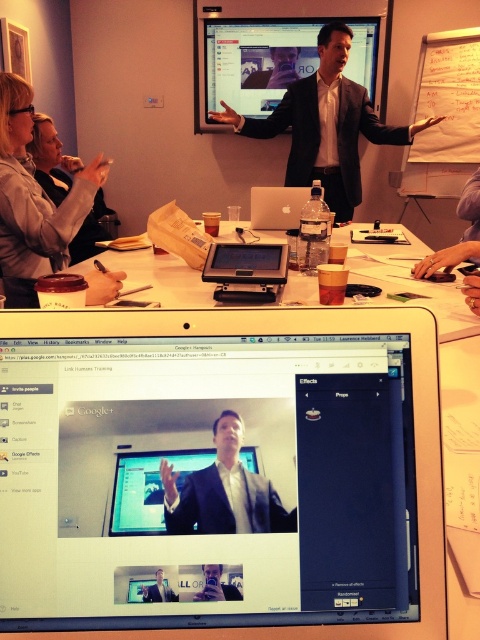
Is matte black monitor at center wider than matte black suit at upper center?

Incorrect, matte black monitor at center's width does not surpass matte black suit at upper center's.

Is point (131, 497) farther from camera compared to point (265, 83)?

No, it is in front of (265, 83).

Image resolution: width=480 pixels, height=640 pixels. What do you see at coordinates (147, 486) in the screenshot?
I see `matte black monitor at center` at bounding box center [147, 486].

Find the location of a particular element. matte black monitor at center is located at coordinates (147, 486).

Is silver metallic laptop at center positioned before matte black monitor at upper center?

Yes, it is in front of matte black monitor at upper center.

Does silver metallic laptop at center have a lesser height compared to matte black monitor at upper center?

Correct, silver metallic laptop at center is not as tall as matte black monitor at upper center.

You are a GUI agent. You are given a task and a screenshot of the screen. Output one action in this format:
    pyautogui.click(x=<x>, y=<y>)
    Task: Click on the silver metallic laptop at center
    The image size is (480, 640).
    Given the screenshot: What is the action you would take?
    205,468

Find the location of a particular element. The image size is (480, 640). silver metallic laptop at center is located at coordinates (205, 468).

Is black suit at center positioned behind light gray shirt at upper left?

Yes, it is.

Between black suit at center and light gray shirt at upper left, which one is positioned higher?

Positioned higher is black suit at center.

Between point (310, 116) and point (35, 212), which one is positioned behind?

The point (310, 116) is behind.

I want to click on black suit at center, so click(325, 124).